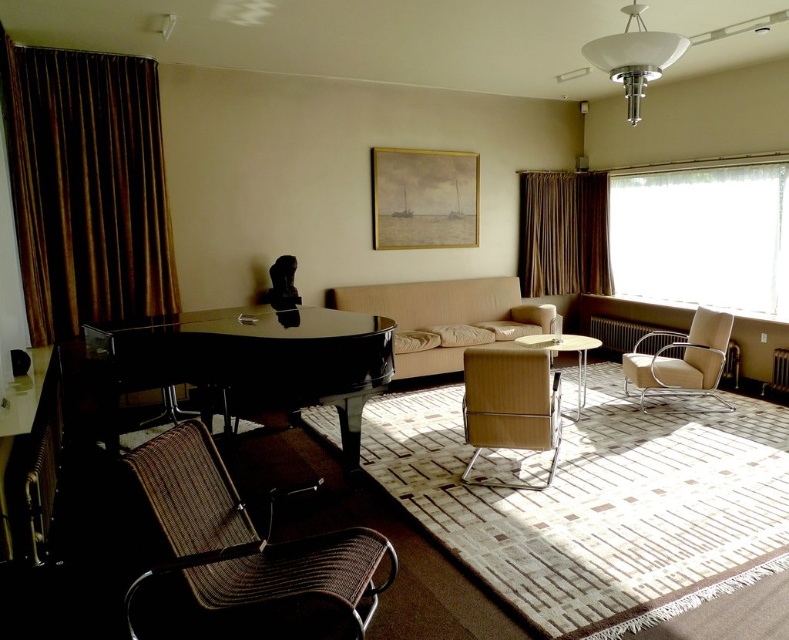
Does brown velvet curtain at right lie in front of metallic silver armchair at right?

No, brown velvet curtain at right is behind metallic silver armchair at right.

Does point (567, 188) lie behind point (671, 356)?

Yes, it is behind point (671, 356).

Find the location of `brown velvet curtain at right`. brown velvet curtain at right is located at coordinates click(x=563, y=234).

Does point (651, 260) lie behind point (589, 284)?

That is False.

Does transparent glass window at right have a lesser height compared to brown velvet curtain at right?

No.

Describe the element at coordinates (701, 236) in the screenshot. The width and height of the screenshot is (789, 640). I see `transparent glass window at right` at that location.

What are the coordinates of `transparent glass window at right` in the screenshot? It's located at (701, 236).

What do you see at coordinates (85, 188) in the screenshot? Image resolution: width=789 pixels, height=640 pixels. I see `brown velvet curtain at left` at bounding box center [85, 188].

Does brown velvet curtain at left have a larger size compared to beige leather couch at center?

Actually, brown velvet curtain at left might be smaller than beige leather couch at center.

Does point (21, 115) lie behind point (443, 288)?

No, it is in front of (443, 288).

The width and height of the screenshot is (789, 640). In order to click on brown velvet curtain at left in this screenshot , I will do `click(85, 188)`.